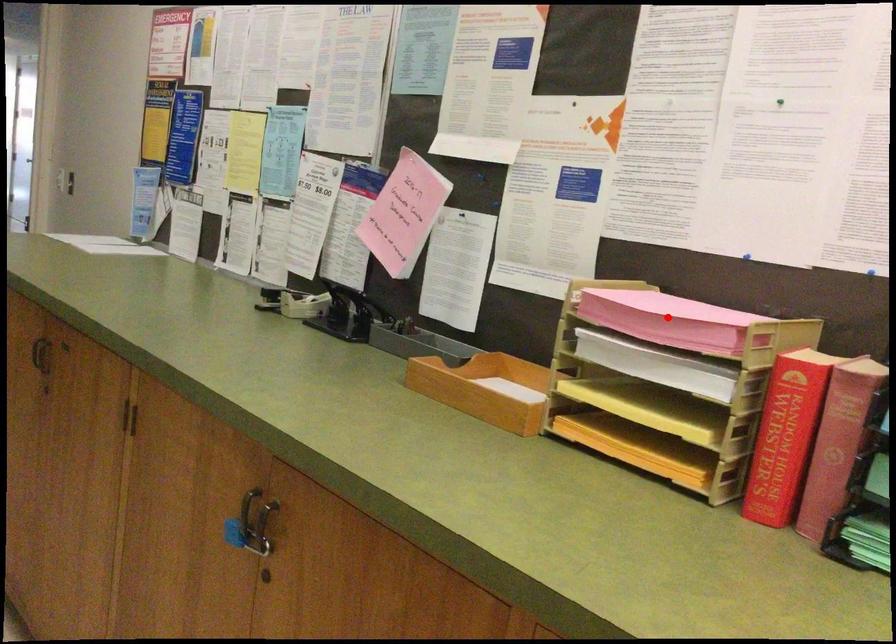
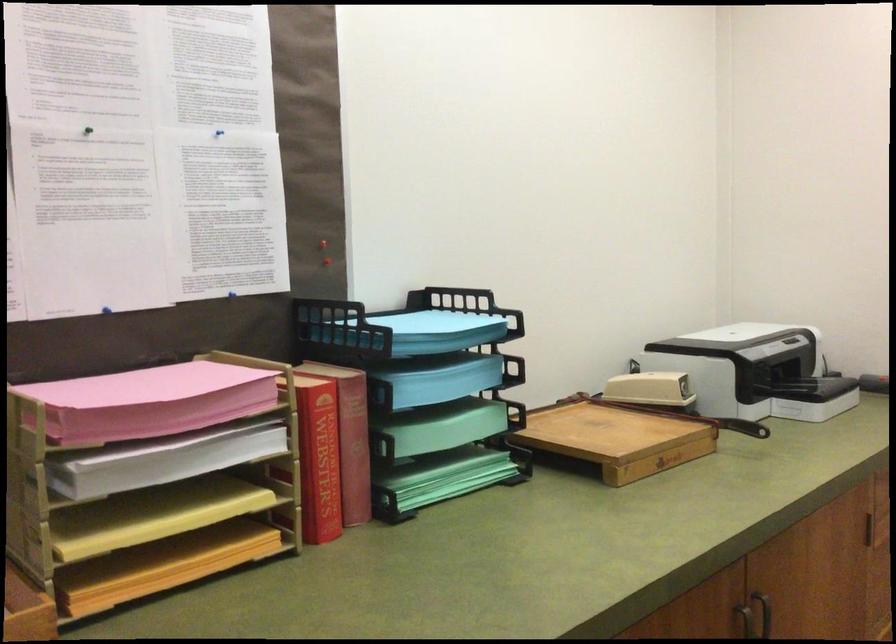
Locate, in the second image, the point that corresponds to the highlighted location in the first image.

(171, 406)